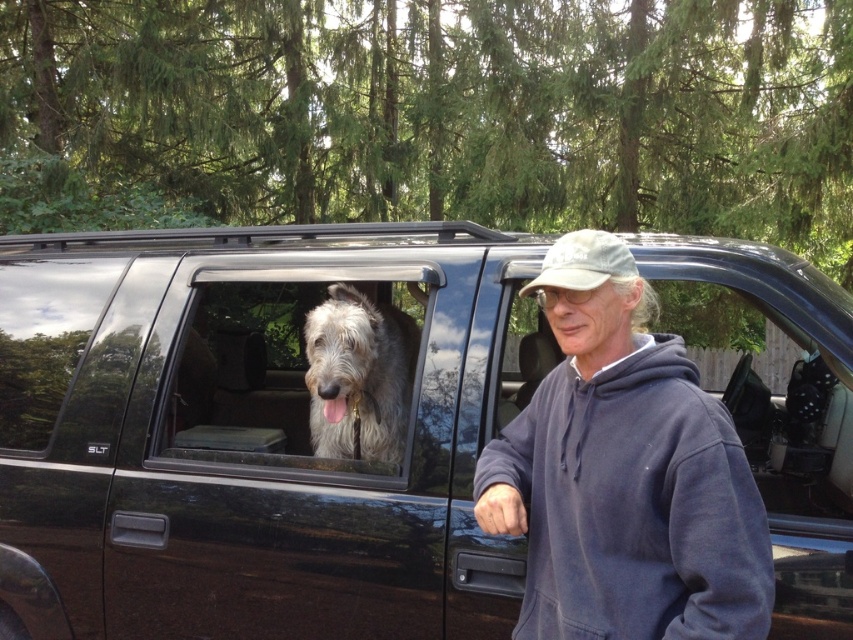
Question: Is navy blue hoodie at center further to camera compared to camouflage fabric baseball cap at center?

Choices:
 (A) yes
 (B) no

Answer: (B)

Question: Can you confirm if glossy black suv at center is wider than navy blue hoodie at center?

Choices:
 (A) no
 (B) yes

Answer: (A)

Question: Estimate the real-world distances between objects in this image. Which object is farther from the fuzzy gray dog at center?

Choices:
 (A) camouflage fabric baseball cap at center
 (B) glossy black suv at center

Answer: (A)

Question: Which point is closer to the camera?

Choices:
 (A) fuzzy gray dog at center
 (B) glossy black suv at center
 (C) navy blue hoodie at center
 (D) fuzzy fur dog at center

Answer: (C)

Question: Which object is the closest to the glossy black suv at center?

Choices:
 (A) camouflage fabric baseball cap at center
 (B) navy blue hoodie at center
 (C) fuzzy fur dog at center

Answer: (B)

Question: Does navy blue hoodie at center have a lesser width compared to camouflage fabric baseball cap at center?

Choices:
 (A) no
 (B) yes

Answer: (A)